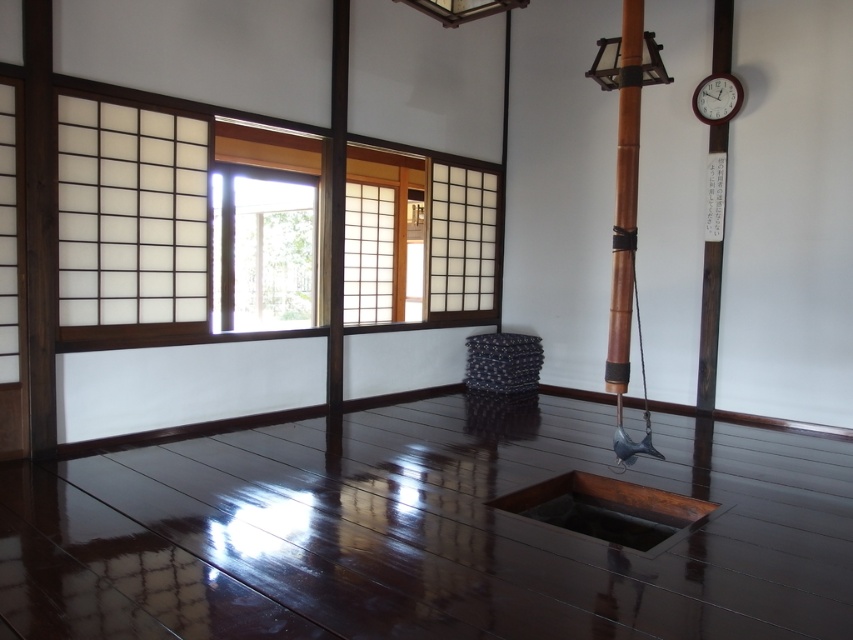
Between point (604, 61) and point (451, 8), which one is positioned behind?

The point (604, 61) is more distant.

Does wooden lantern at upper center have a greater height compared to wooden textured lampshade at upper center?

Yes.

Who is more forward, (x=608, y=60) or (x=489, y=3)?

Point (x=489, y=3) is more forward.

Where is `wooden lantern at upper center`? This screenshot has height=640, width=853. wooden lantern at upper center is located at coordinates (606, 64).

Is point (706, 108) positioned before point (440, 20)?

No, it is behind (440, 20).

Is white plastic clock at upper right to the left of wooden textured lampshade at upper center from the viewer's perspective?

In fact, white plastic clock at upper right is to the right of wooden textured lampshade at upper center.

Between point (738, 86) and point (463, 1), which one is positioned behind?

The point (738, 86) is more distant.

Find the location of a particular element. Image resolution: width=853 pixels, height=640 pixels. white plastic clock at upper right is located at coordinates (717, 99).

Is the position of brown polished bamboo pole at upper center less distant than that of wooden textured lampshade at upper center?

No, it is not.

Does brown polished bamboo pole at upper center appear on the left side of wooden textured lampshade at upper center?

Incorrect, brown polished bamboo pole at upper center is not on the left side of wooden textured lampshade at upper center.

You are a GUI agent. You are given a task and a screenshot of the screen. Output one action in this format:
    pyautogui.click(x=<x>, y=<y>)
    Task: Click on the brown polished bamboo pole at upper center
    
    Given the screenshot: What is the action you would take?
    pyautogui.click(x=625, y=196)